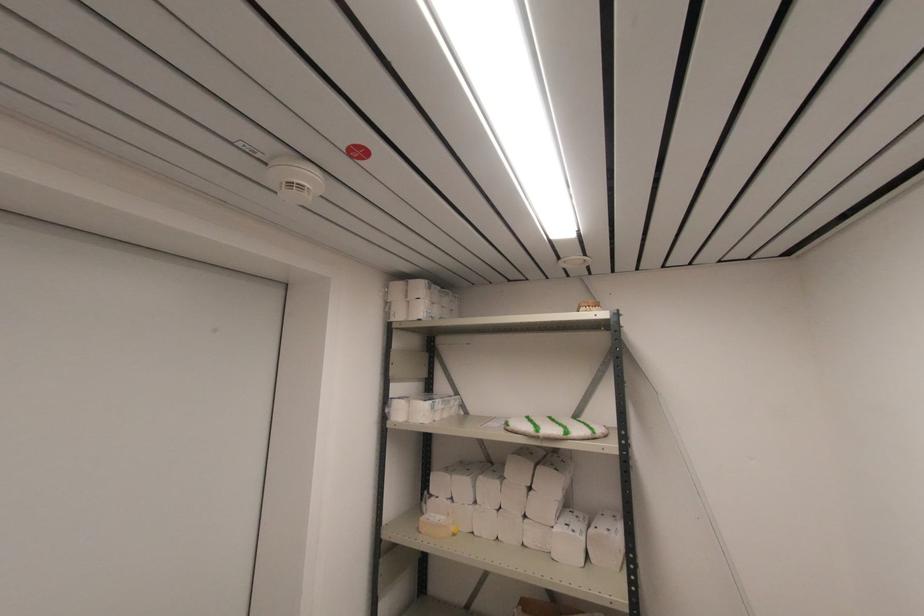
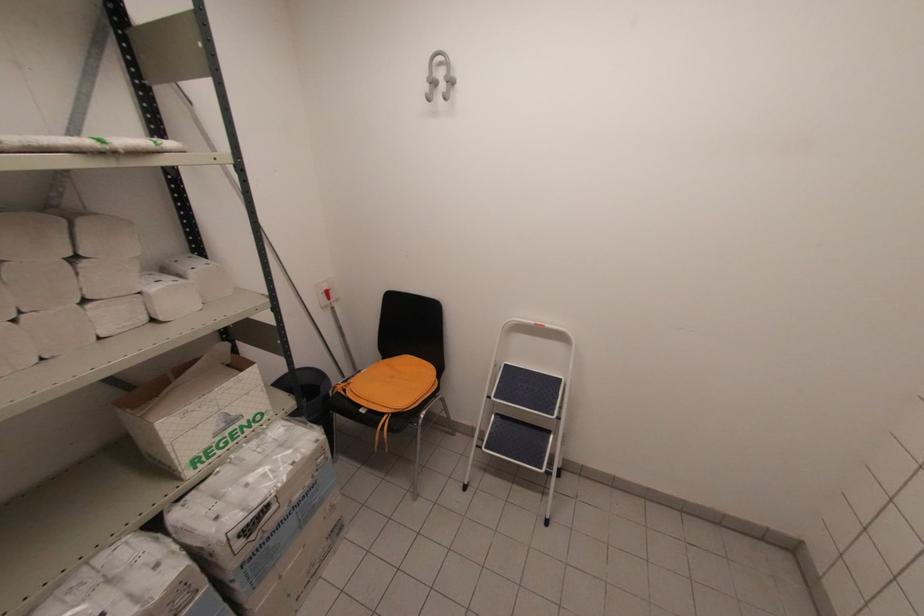
Find the pixel in the second image that matches point 537,436 in the first image.

(107, 148)